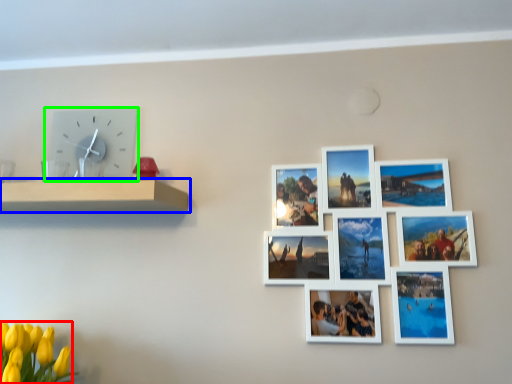
Question: Considering the real-world distances, which object is farthest from flower (highlighted by a red box)? shelf (highlighted by a blue box) or wall clock (highlighted by a green box)?

Choices:
 (A) shelf
 (B) wall clock

Answer: (B)